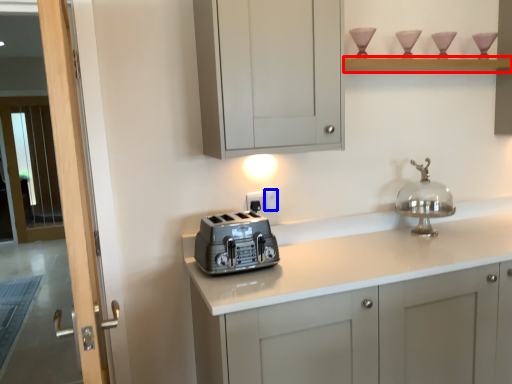
Question: Which of the following is the closest to the observer, shelf (highlighted by a red box) or electric outlet (highlighted by a blue box)?

Choices:
 (A) shelf
 (B) electric outlet

Answer: (A)